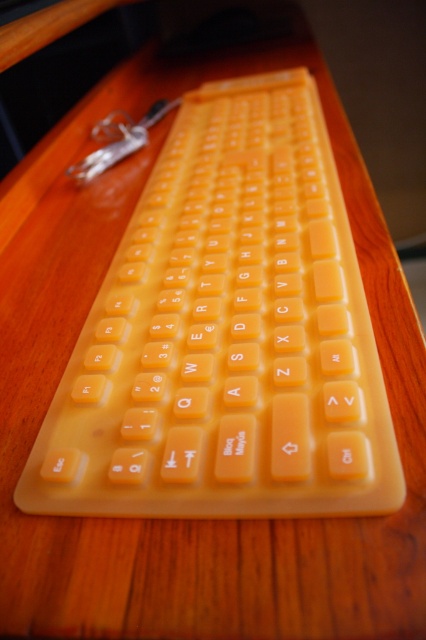
Question: Which point is closer to the camera?

Choices:
 (A) (363, 502)
 (B) (97, 124)

Answer: (A)

Question: From the image, what is the correct spatial relationship of yellow rubber keyboard at center in relation to matte orange key at upper left?

Choices:
 (A) left
 (B) right

Answer: (B)

Question: Does yellow rubber keyboard at center appear on the right side of matte orange key at upper left?

Choices:
 (A) no
 (B) yes

Answer: (B)

Question: Which object appears closest to the camera in this image?

Choices:
 (A) yellow rubber keyboard at center
 (B) matte orange key at upper left

Answer: (A)

Question: Which point is farther to the camera?

Choices:
 (A) (190, 337)
 (B) (106, 148)

Answer: (B)

Question: Is yellow rubber keyboard at center above matte orange key at upper left?

Choices:
 (A) no
 (B) yes

Answer: (A)